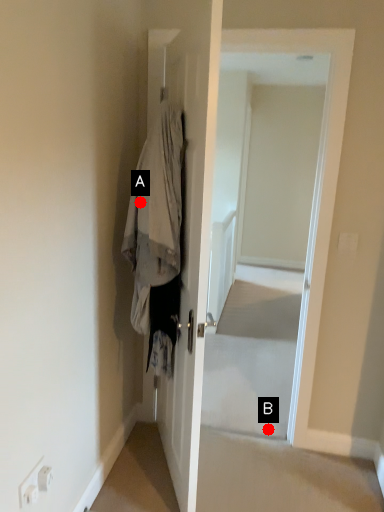
Question: Two points are circled on the image, labeled by A and B beside each circle. Which point is closer to the camera?

Choices:
 (A) A is closer
 (B) B is closer

Answer: (A)